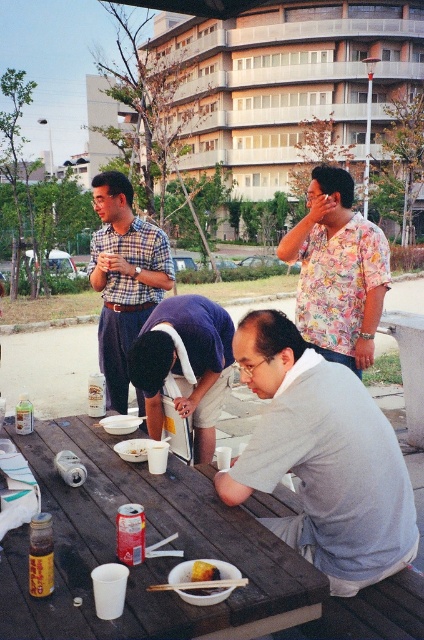
Who is more forward, (145, 221) or (128, 449)?

Point (128, 449) is in front.

Does plaid shirt at upper left have a larger size compared to white paper bowl at table center?

Indeed, plaid shirt at upper left has a larger size compared to white paper bowl at table center.

Where is `plaid shirt at upper left`? Image resolution: width=424 pixels, height=640 pixels. plaid shirt at upper left is located at coordinates (123, 276).

Does point (217, 577) lie behind point (145, 452)?

No, it is not.

Can you confirm if brown crumbly cake at center is shorter than white paper bowl at table center?

In fact, brown crumbly cake at center may be taller than white paper bowl at table center.

Which is in front, point (206, 564) or point (142, 449)?

Point (206, 564) is in front.

Where is `brown crumbly cake at center`? This screenshot has height=640, width=424. brown crumbly cake at center is located at coordinates (203, 572).

Between gray matte shirt at lower right and plaid shirt at upper left, which one has less height?

gray matte shirt at lower right is shorter.

Who is positioned more to the right, gray matte shirt at lower right or plaid shirt at upper left?

Positioned to the right is gray matte shirt at lower right.

Find the location of a particular element. This screenshot has width=424, height=640. gray matte shirt at lower right is located at coordinates (323, 458).

Where is `gray matte shirt at lower right`? gray matte shirt at lower right is located at coordinates (323, 458).